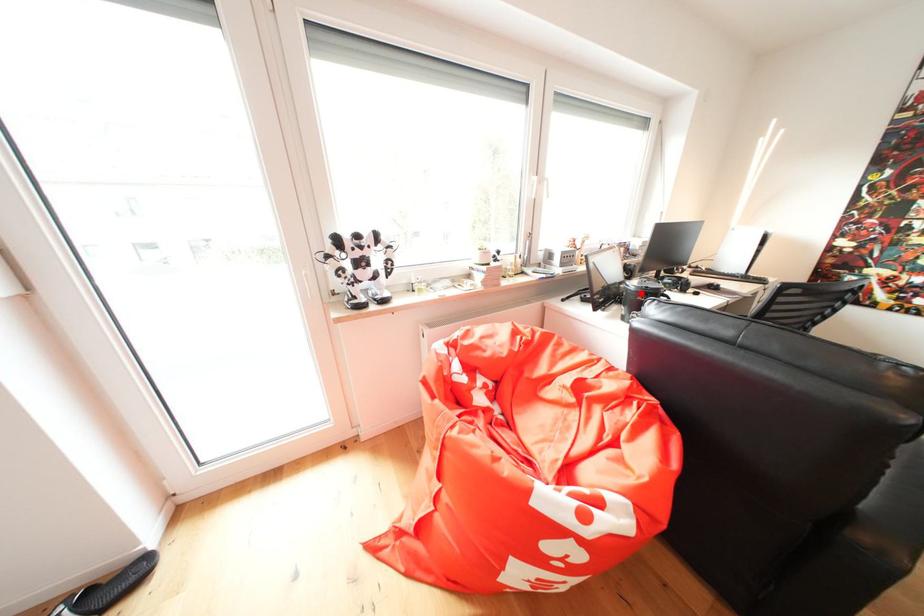
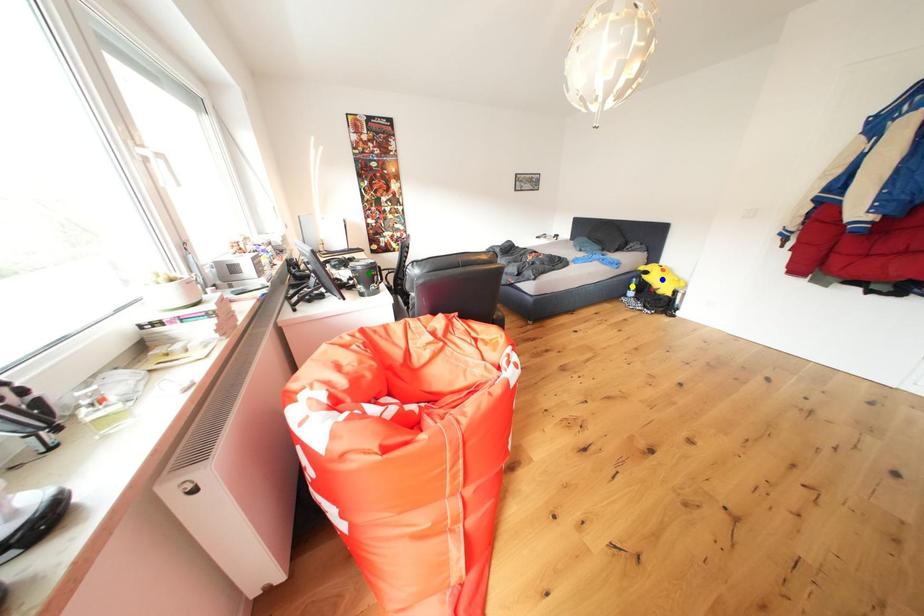
Question: I am providing you with two images of the same scene from different viewpoints. A red point is marked on the first image. You are given multiple points on the second image. In image 2, which mark is for the same physical point as the one in image 1?

Choices:
 (A) blue point
 (B) yellow point
 (C) green point

Answer: (C)